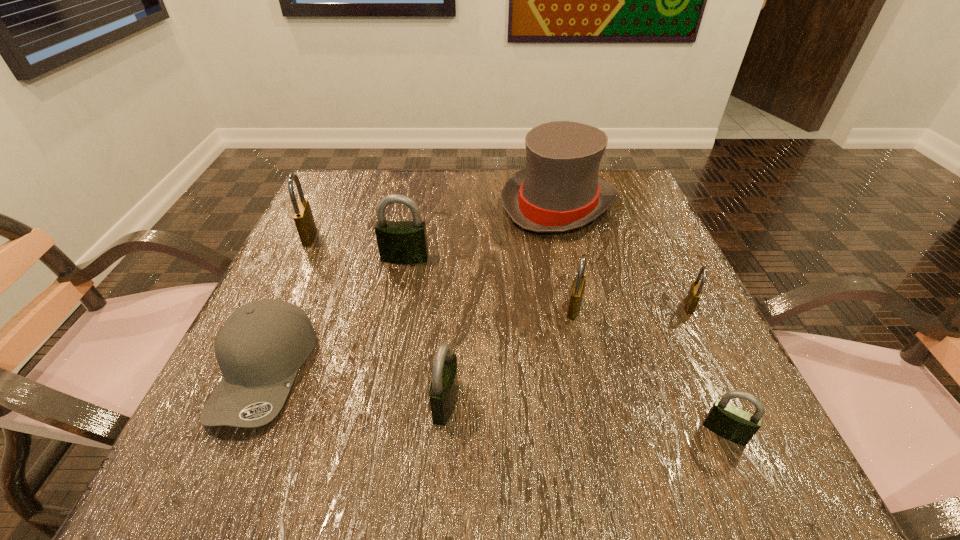
The width and height of the screenshot is (960, 540). Find the location of `baseball cap at the near edge`. baseball cap at the near edge is located at coordinates (261, 346).

Locate an element on the screen. This screenshot has height=540, width=960. padlock that is at the left edge is located at coordinates (303, 217).

The height and width of the screenshot is (540, 960). I want to click on baseball cap located in the left edge section of the desktop, so pos(261,346).

What are the coordinates of `dress hat located in the right edge section of the desktop` in the screenshot? It's located at (559, 190).

Where is `object at the near left corner`? object at the near left corner is located at coordinates (261, 346).

Where is `object situated at the far right corner`? object situated at the far right corner is located at coordinates (559, 190).

Where is `object that is at the near right corner`? object that is at the near right corner is located at coordinates (732, 423).

You are a GUI agent. You are given a task and a screenshot of the screen. Output one action in this format:
    pyautogui.click(x=<x>, y=<y>)
    Task: Click on the free space at the far edge
    This screenshot has height=540, width=960.
    Given the screenshot: What is the action you would take?
    pyautogui.click(x=417, y=175)

Locate an element on the screen. Image resolution: width=960 pixels, height=540 pixels. vacant space at the near edge is located at coordinates (365, 479).

You are a GUI agent. You are given a task and a screenshot of the screen. Output one action in this format:
    pyautogui.click(x=<x>, y=<y>)
    Task: Click on the free space at the left edge of the desktop
    This screenshot has width=960, height=540.
    Given the screenshot: What is the action you would take?
    pyautogui.click(x=314, y=374)